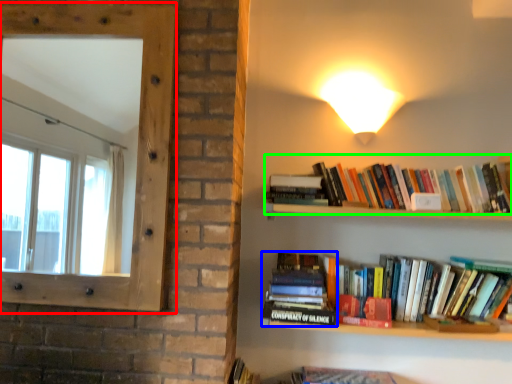
Question: Which object is the farthest from window screen (highlighted by a red box)? Choose among these: book (highlighted by a blue box) or book (highlighted by a green box).

Choices:
 (A) book
 (B) book

Answer: (B)